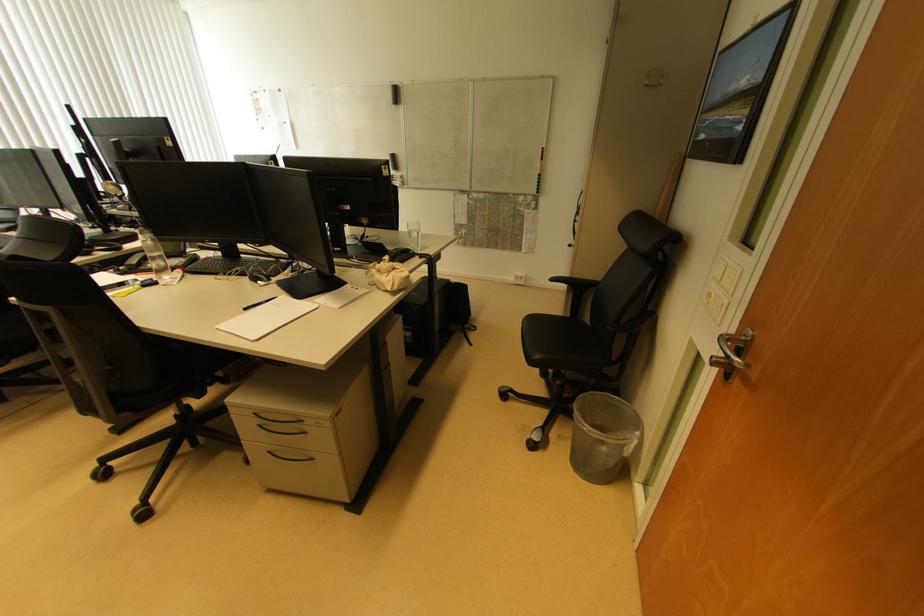
Find where to lift the cloth pouch. Please return your answer as a coordinate pair (x, y).

(387, 275)